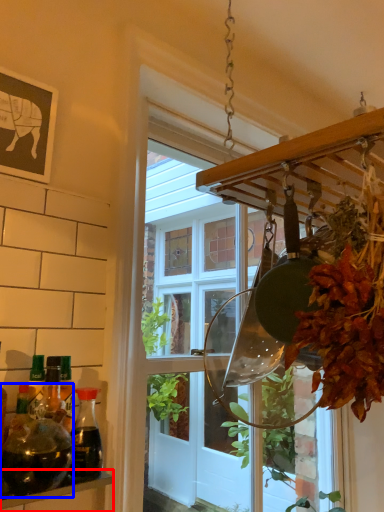
Question: Which object is further to the camera taking this photo, shelf (highlighted by a red box) or bottle (highlighted by a blue box)?

Choices:
 (A) shelf
 (B) bottle

Answer: (B)